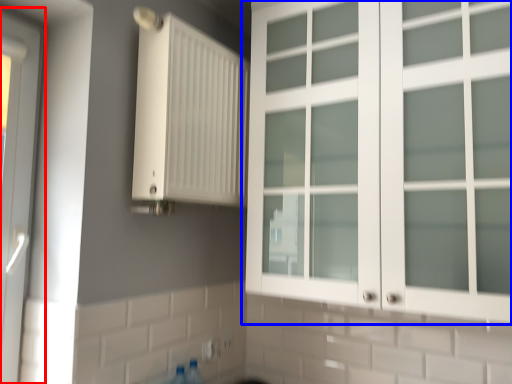
Question: Which of the following is the farthest to the observer, door (highlighted by a red box) or cupboard (highlighted by a blue box)?

Choices:
 (A) door
 (B) cupboard

Answer: (A)